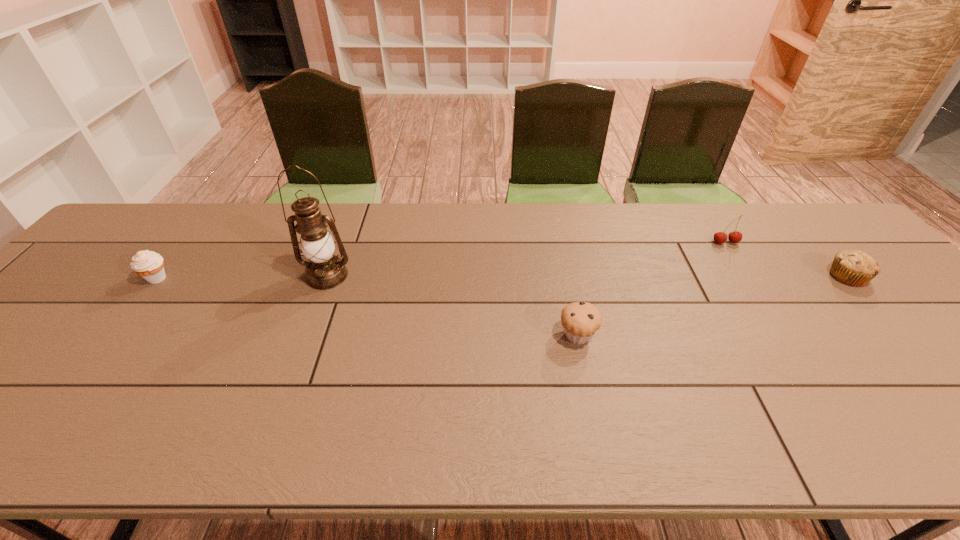
Where is `the closest object relative to the cherry`? This screenshot has width=960, height=540. the closest object relative to the cherry is located at coordinates (855, 268).

Find the location of `the third closest object relative to the farthest object`. the third closest object relative to the farthest object is located at coordinates (325, 271).

Choose which muffin is the nearest neighbor to the leftmost muffin. Please provide its 2D coordinates. Your answer should be formatted as a tuple, i.e. [(x, y)], where the tuple contains the x and y coordinates of a point satisfying the conditions above.

[(580, 320)]

You are a GUI agent. You are given a task and a screenshot of the screen. Output one action in this format:
    pyautogui.click(x=<x>, y=<y>)
    Task: Click on the muffin that is the second closest to the nearest muffin
    This screenshot has width=960, height=540.
    Given the screenshot: What is the action you would take?
    pyautogui.click(x=148, y=264)

Locate an element on the screen. vacant position in the image that satisfies the following two spatial constraints: 1. on the front side of the nearest object; 2. on the right side of the fourth object from right to left is located at coordinates (305, 336).

Locate an element on the screen. vacant space that satisfies the following two spatial constraints: 1. on the back side of the leftmost object; 2. on the right side of the tallest object is located at coordinates (159, 276).

I want to click on free space that satisfies the following two spatial constraints: 1. on the surface of the rightmost muffin; 2. on the left side of the farthest object, so click(x=748, y=276).

The width and height of the screenshot is (960, 540). Identify the location of free space that satisfies the following two spatial constraints: 1. on the front side of the nearest object; 2. on the left side of the oil lamp. (305, 336).

Locate an element on the screen. Image resolution: width=960 pixels, height=540 pixels. free location that satisfies the following two spatial constraints: 1. on the front side of the second muffin from left to right; 2. on the left side of the leftmost muffin is located at coordinates (112, 336).